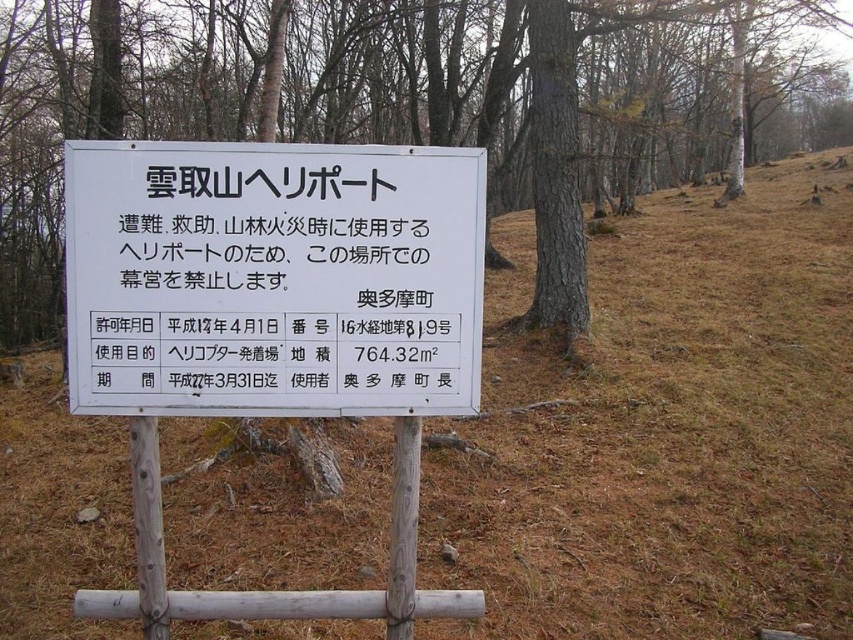
You are a hiker carrying a 2.5 meter long telescopic pole that can be extended fully. You are standing at the base of the brown bark tree at center and want to reach the white plastic sign at center. Can you extend the pole to touch the sign without moving from your current position?

The distance between the brown bark tree at center and the white plastic sign at center is 6.04 meters. Since the telescopic pole can only extend to 2.5 meters, it is not long enough to reach the sign from the tree.

You are a helicopter pilot preparing to land at the Yunotake Helipad. You notice a brown bark tree at center in your line of sight. Considering the standard helicopter rotor diameter of 15 meters, is there enough space between the tree and your position to safely land?

The distance between the brown bark tree at center and the camera is 2.70 meters. Since the helicopter rotor has a diameter of 15 meters, the distance is insufficient to safely land as the rotor would come into contact with the tree.

Based on the photo, you are a hiker trying to locate the Yunotake Helipad. You see a brown bark tree at center and a white plastic sign at center. Which object is larger in size?

The brown bark tree at center is bigger than the white plastic sign at center.